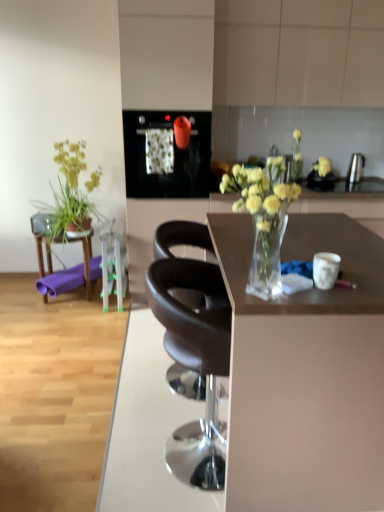
Identify the location of free area below matte brown chair at center, the first chair viewed from the front (from a real-world perspective). The height and width of the screenshot is (512, 384). (179, 448).